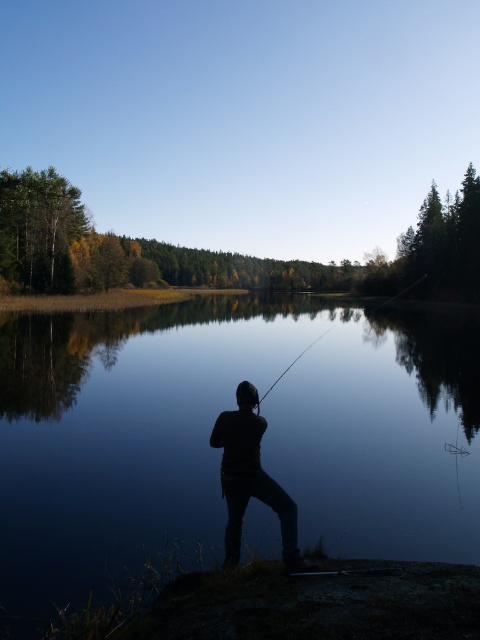
Is point (230, 417) positioned before point (264, 392)?

Yes, point (230, 417) is in front of point (264, 392).

Is point (276, 509) positioned behind point (324, 333)?

No, it is not.

Identify the location of black matte person at center. The width and height of the screenshot is (480, 640). (251, 477).

Can you confirm if transparent water at center is bigger than black matte person at center?

Yes, transparent water at center is bigger than black matte person at center.

The image size is (480, 640). What do you see at coordinates (219, 451) in the screenshot? I see `transparent water at center` at bounding box center [219, 451].

Does point (36, 513) lie behind point (238, 541)?

Yes, it is behind point (238, 541).

Locate an element on the screen. transparent water at center is located at coordinates (219, 451).

Is transparent water at center in front of smooth black rod at center?

Yes, it is in front of smooth black rod at center.

Describe the element at coordinates (219, 451) in the screenshot. The height and width of the screenshot is (640, 480). I see `transparent water at center` at that location.

Is point (79, 497) less distant than point (300, 355)?

That is True.

In order to click on transparent water at center in this screenshot , I will do `click(219, 451)`.